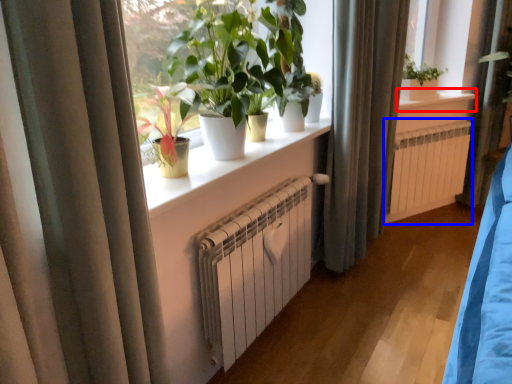
Question: Which object appears closest to the camera in this image, window sill (highlighted by a red box) or air conditioning (highlighted by a blue box)?

Choices:
 (A) window sill
 (B) air conditioning

Answer: (A)